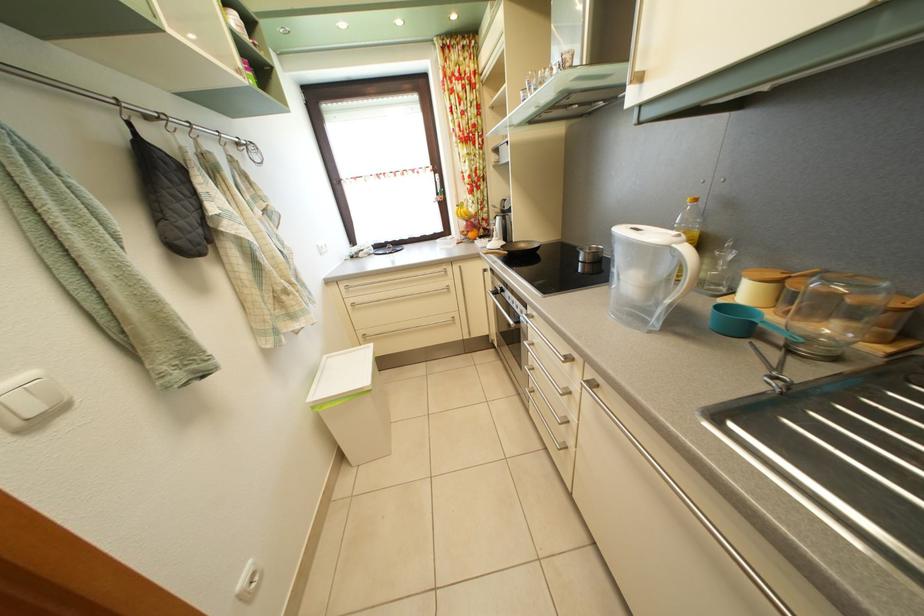
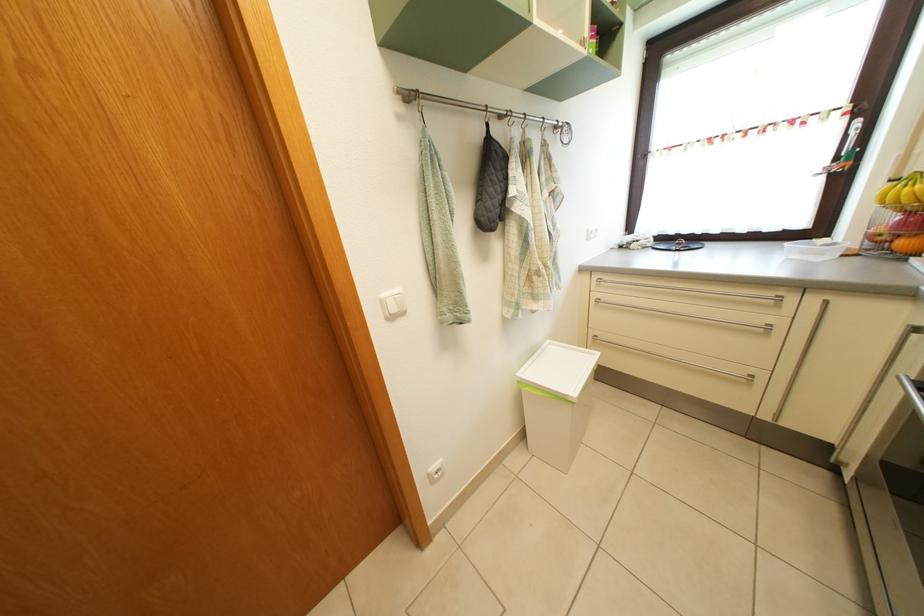
Locate, in the second image, the point that corresponds to the point at 378,339 in the first image.

(611, 344)